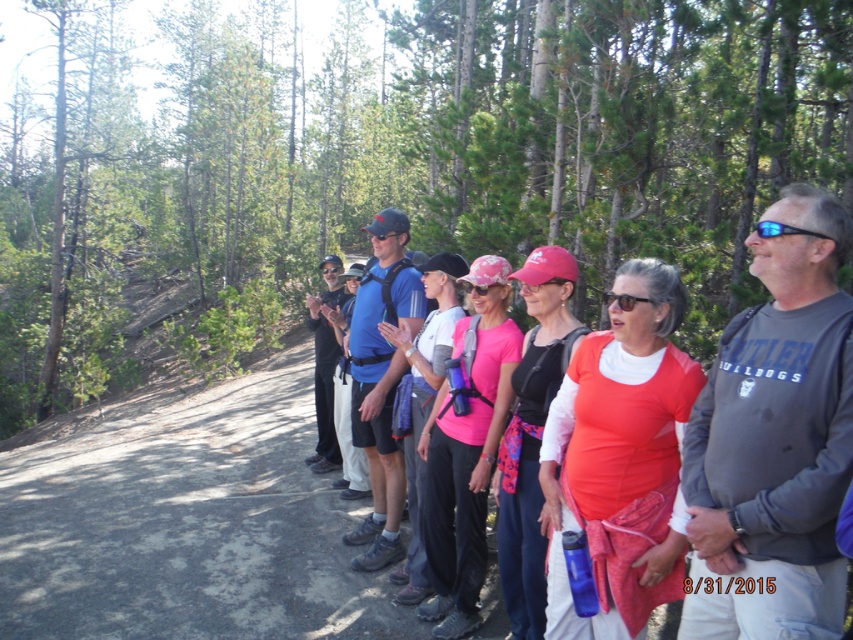
Between point (755, 120) and point (677, 301), which one is positioned behind?

The point (755, 120) is more distant.

Between point (189, 276) and point (674, 385), which one is positioned in front?

Point (674, 385) is more forward.

Which is behind, point (115, 128) or point (668, 403)?

Point (115, 128)

Identify the location of green leafy trees at center. This screenshot has height=640, width=853. (409, 150).

Find the location of `gray cotton sweatshirt at right`. gray cotton sweatshirt at right is located at coordinates (775, 436).

Does point (813, 429) come closer to viewer compared to point (651, 349)?

Yes, point (813, 429) is closer to viewer.

Identify the location of gray cotton sweatshirt at right. The height and width of the screenshot is (640, 853). (775, 436).

Is green leafy trees at center to the left of gray cotton sweatshirt at right from the viewer's perspective?

Correct, you'll find green leafy trees at center to the left of gray cotton sweatshirt at right.

Is green leafy trees at center wider than gray cotton sweatshirt at right?

Correct, the width of green leafy trees at center exceeds that of gray cotton sweatshirt at right.

The image size is (853, 640). I want to click on green leafy trees at center, so click(409, 150).

At what (x,y) coordinates should I click in order to perform the action: click on green leafy trees at center. Please return your answer as a coordinate pair (x, y). The image size is (853, 640). Looking at the image, I should click on (409, 150).